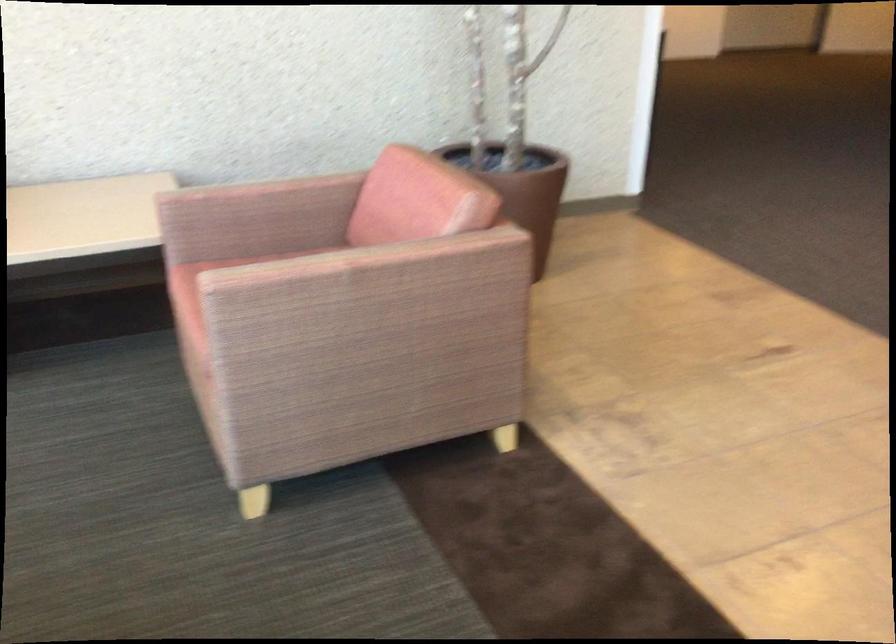
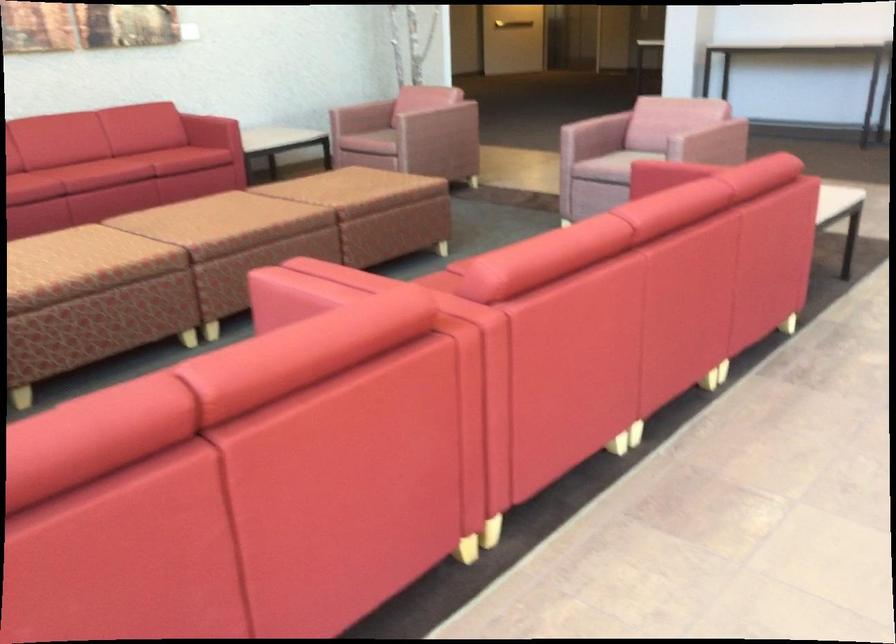
Locate, in the second image, the point that corresponds to pixel 291 281 in the first image.

(431, 106)